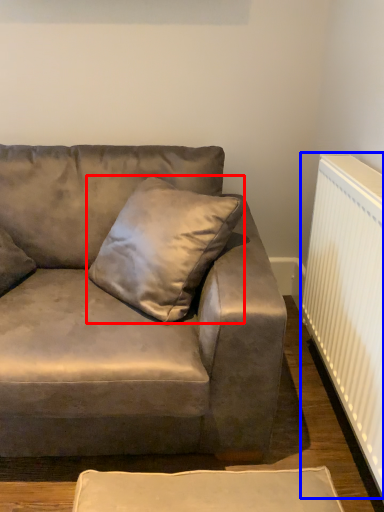
Question: Which point is further to the camera, pillow (highlighted by a red box) or radiator (highlighted by a blue box)?

Choices:
 (A) pillow
 (B) radiator

Answer: (B)